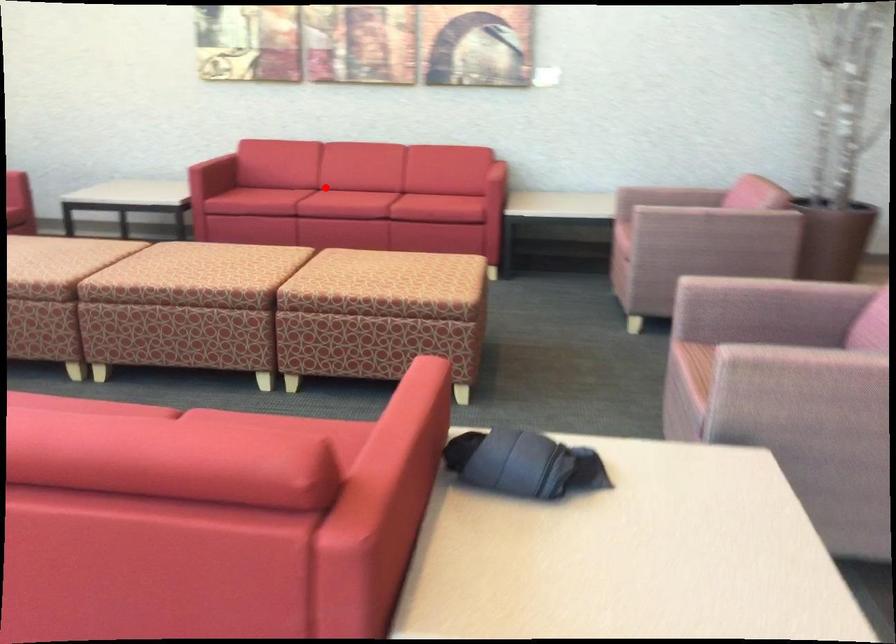
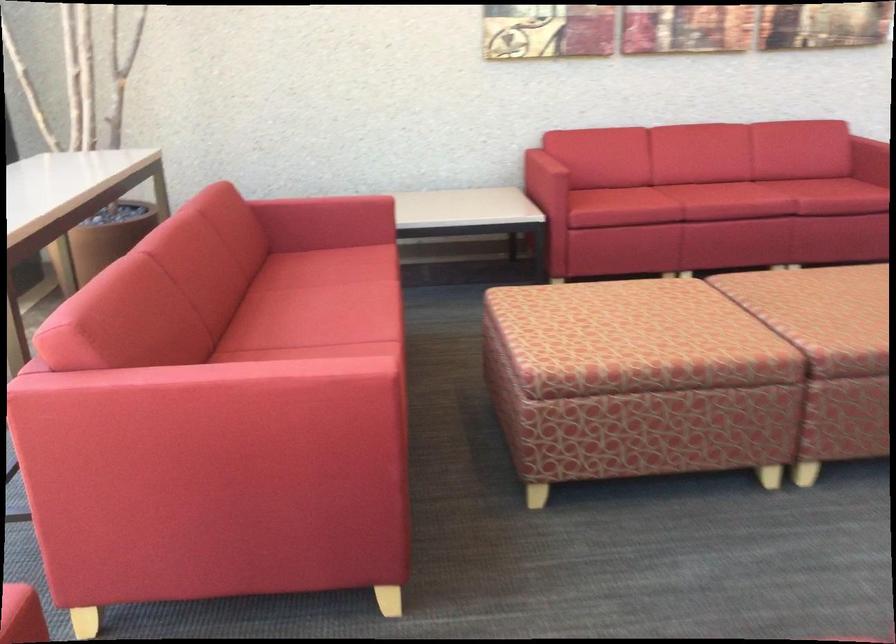
Question: I am providing you with two images of the same scene from different viewpoints. Given a red point in image1, look at the same physical point in image2. Is it:

Choices:
 (A) Closer to the viewpoint
 (B) Farther from the viewpoint

Answer: (A)